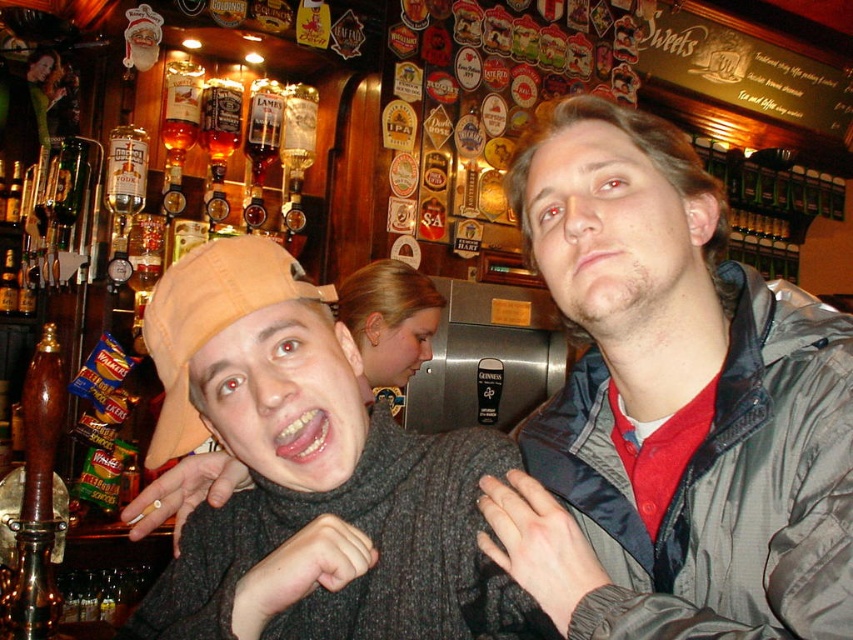
You are a barista trying to place two items on a narrow shelf that can only hold items of a certain width. You have the gray fabric jacket at center and the knitted sweater at center. Which item should you choose to fit on the shelf if the shelf can only accommodate the narrower item?

The gray fabric jacket at center has a lesser width compared to the knitted sweater at center, so you should choose the gray fabric jacket at center to fit on the narrow shelf.

You are a barista trying to identify the customer in the center of the image. Which item is positioned higher on their body between the gray fabric jacket at center and the knitted sweater at center?

The gray fabric jacket at center is located above the knitted sweater at center, so the gray fabric jacket at center is positioned higher on their body.